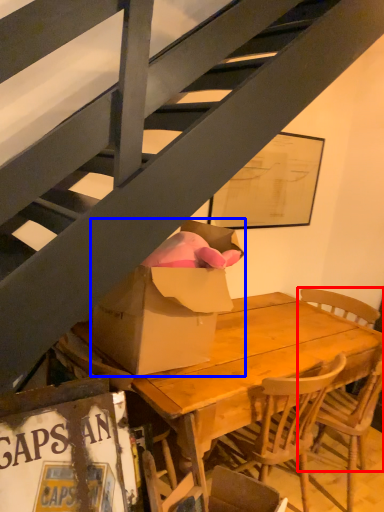
Question: Which object appears closest to the camera in this image, chair (highlighted by a red box) or box (highlighted by a blue box)?

Choices:
 (A) chair
 (B) box

Answer: (B)